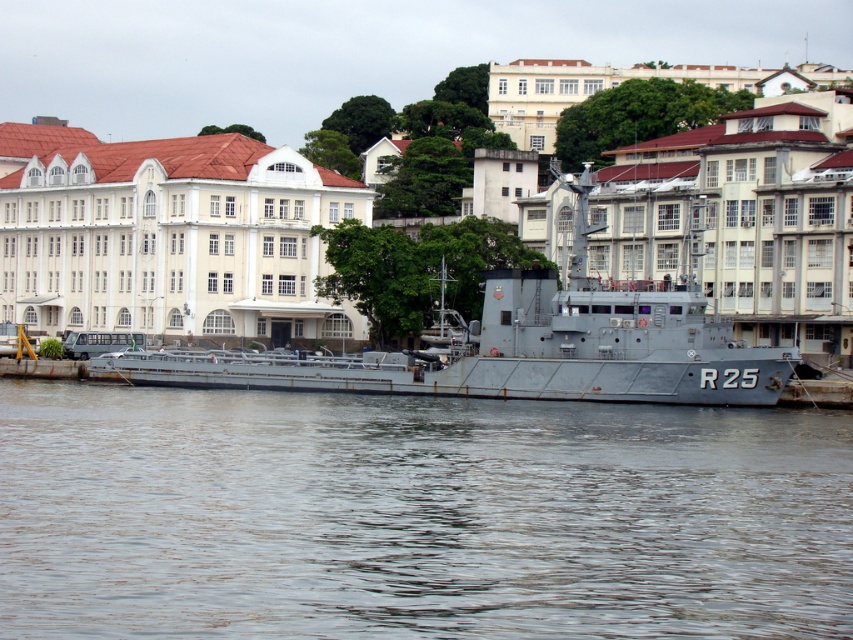
Question: Does brown water at lower center come behind gray metallic ship at center?

Choices:
 (A) no
 (B) yes

Answer: (A)

Question: Does brown water at lower center have a larger size compared to gray metallic ship at center?

Choices:
 (A) yes
 (B) no

Answer: (B)

Question: Is brown water at lower center positioned before gray metallic ship at center?

Choices:
 (A) no
 (B) yes

Answer: (B)

Question: Among these objects, which one is nearest to the camera?

Choices:
 (A) gray metallic ship at center
 (B) brown water at lower center

Answer: (B)